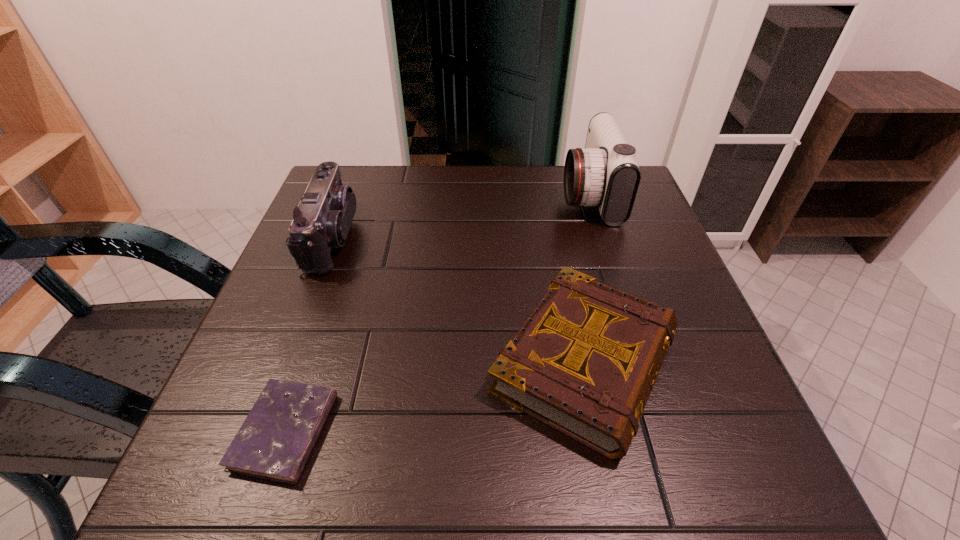
Image resolution: width=960 pixels, height=540 pixels. I want to click on object that is at the far right corner, so click(x=605, y=174).

The width and height of the screenshot is (960, 540). In order to click on object that is at the near right corner in this screenshot , I will do `click(585, 361)`.

The image size is (960, 540). I want to click on free location at the far edge of the desktop, so click(x=416, y=215).

You are a GUI agent. You are given a task and a screenshot of the screen. Output one action in this format:
    pyautogui.click(x=<x>, y=<y>)
    Task: Click on the free region at the near edge
    This screenshot has width=960, height=540.
    Given the screenshot: What is the action you would take?
    pyautogui.click(x=428, y=443)

Locate an element on the screen. The height and width of the screenshot is (540, 960). vacant space at the left edge of the desktop is located at coordinates (352, 284).

Find the location of a particular element. free region at the right edge of the desktop is located at coordinates (684, 340).

This screenshot has height=540, width=960. Identify the location of vacant space at the near right corner of the desktop. (697, 463).

Locate an element on the screen. This screenshot has height=540, width=960. vacant point located between the second tallest object and the second shortest object is located at coordinates (459, 300).

The height and width of the screenshot is (540, 960). In order to click on vacant space that is in between the shortest object and the left camcorder in this screenshot , I will do `click(309, 334)`.

The height and width of the screenshot is (540, 960). In order to click on free space that is in between the hardback book and the third shortest object in this screenshot , I will do `click(459, 300)`.